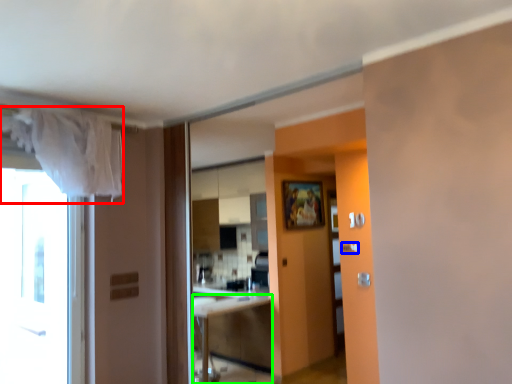
Question: Based on their relative distances, which object is farther from curtain (highlighted by a red box)? Choose from door handle (highlighted by a blue box) and cabinetry (highlighted by a green box).

Choices:
 (A) door handle
 (B) cabinetry

Answer: (B)